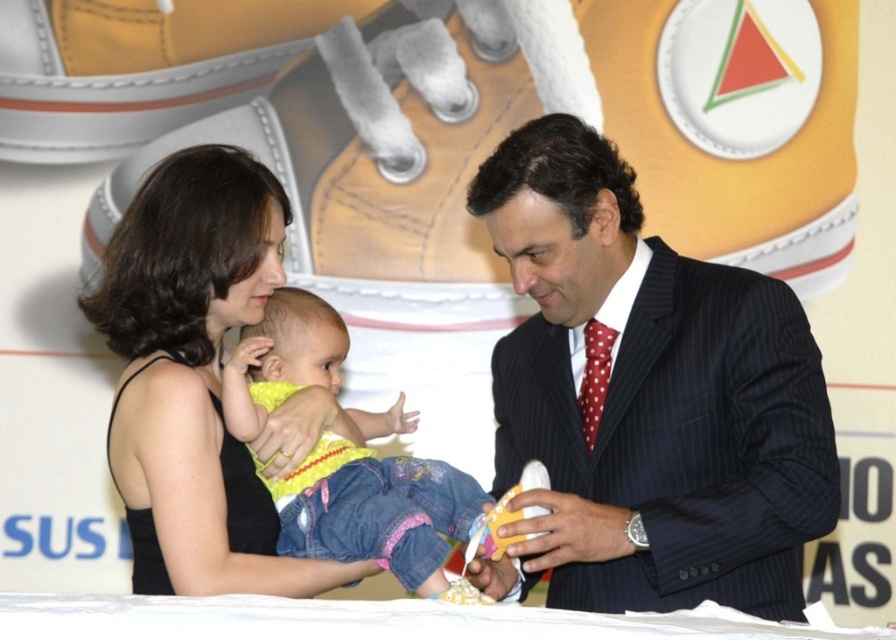
Question: Among these objects, which one is farthest from the camera?

Choices:
 (A) black fabric dress at center
 (B) yellow denim pants at center
 (C) dark pinstripe suit at center

Answer: (B)

Question: Is the position of dark pinstripe suit at center less distant than that of black fabric dress at center?

Choices:
 (A) no
 (B) yes

Answer: (A)

Question: In this image, where is dark pinstripe suit at center located relative to black fabric dress at center?

Choices:
 (A) left
 (B) right

Answer: (B)

Question: From the image, what is the correct spatial relationship of dark pinstripe suit at center in relation to yellow denim pants at center?

Choices:
 (A) left
 (B) right

Answer: (B)

Question: Which point appears closest to the camera in this image?

Choices:
 (A) (789, 410)
 (B) (319, 344)
 (C) (197, 320)

Answer: (A)

Question: Which point appears closest to the camera in this image?

Choices:
 (A) (343, 456)
 (B) (521, 419)

Answer: (A)